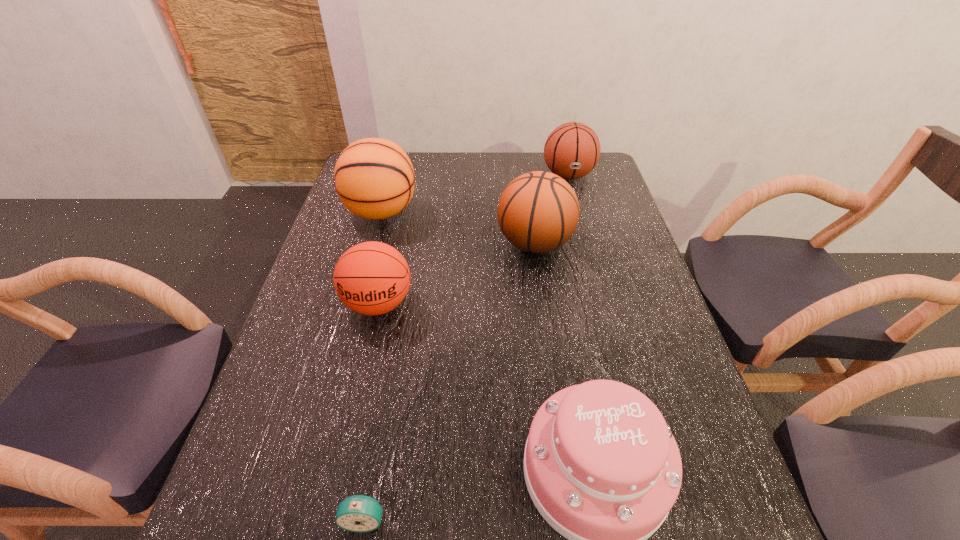
Find the location of a particular element. This screenshot has width=960, height=540. free space at the near edge of the desktop is located at coordinates (321, 530).

This screenshot has width=960, height=540. Find the location of `vacant area at the right edge`. vacant area at the right edge is located at coordinates (651, 378).

Identify the location of vacant space that is in between the alarm clock and the farthest object. The width and height of the screenshot is (960, 540). (467, 347).

The image size is (960, 540). Find the location of `object identified as the fifth closest to the farthest basketball`. object identified as the fifth closest to the farthest basketball is located at coordinates (358, 513).

Where is `object that is the third closest one to the shortest object`? This screenshot has height=540, width=960. object that is the third closest one to the shortest object is located at coordinates (538, 212).

Select which basketball appears as the fourth closest to the cake. Please provide its 2D coordinates. Your answer should be formatted as a tuple, i.e. [(x, y)], where the tuple contains the x and y coordinates of a point satisfying the conditions above.

[(572, 150)]

Identify the location of the closest basketball relative to the fourth farthest object. (374, 178).